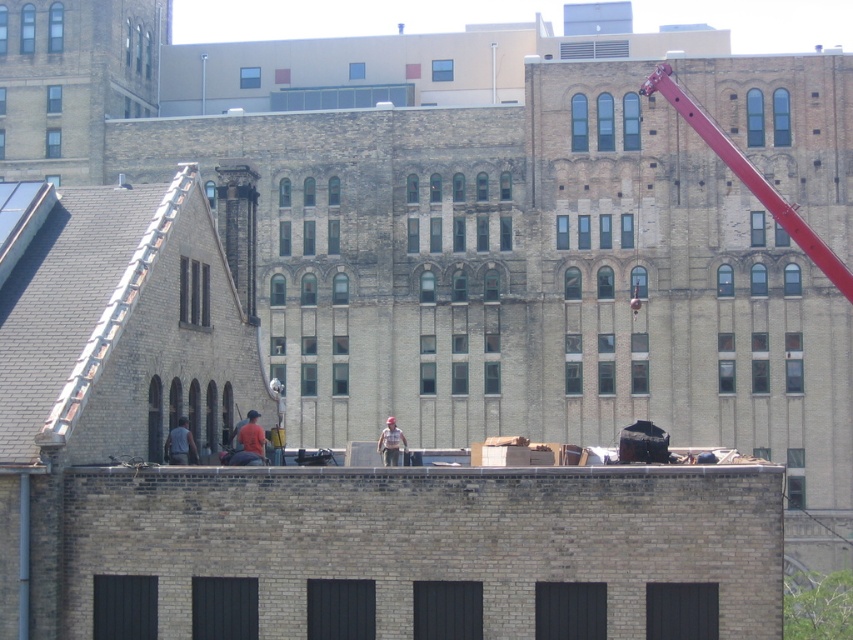
You are a construction supervisor looking at the site from the ground. You see the red metallic crane at upper right and the dark gray fabric jacket at center. Which object is higher in the air?

The red metallic crane at upper right is higher in the air than the dark gray fabric jacket at center because it is positioned above it.

You are a construction supervisor who needs to move a heavy tool from the red metallic crane at upper right to the dark gray fabric jacket at center. Can you safely transport it without needing to move the tool more than 25 meters?

The red metallic crane at upper right and dark gray fabric jacket at center are 25.46 meters apart from each other. Since the maximum allowed distance is 25 meters, the tool cannot be safely transported without exceeding the distance limit.

You are a construction supervisor observing the scene. You need to ensure that the red metallic crane at upper right and the camouflage fabric worker at center are positioned safely. Based on their positions, which object is located to the right side of the other?

The red metallic crane at upper right is to the right of the camouflage fabric worker at center, so the crane is positioned to the right of the worker.